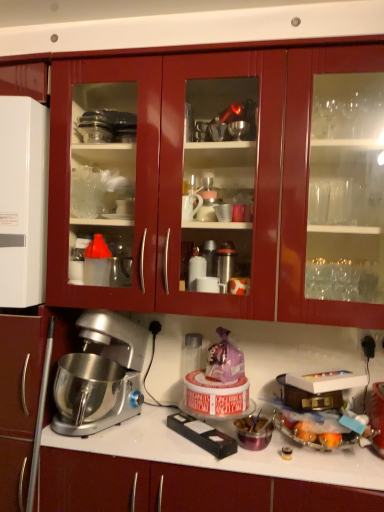
Find the location of a particular element. vacant space underneath translucent plastic container at lower right, the 1th appliance positioned from the bottom (from a real-world perspective) is located at coordinates (322, 452).